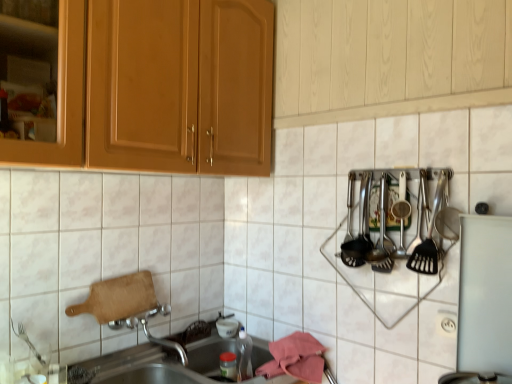
Question: Is polished stainless steel utensils at right, marked as the second silverware in a back-to-front arrangement, to the right of polished stainless steel utensils at right, which appears as the 1th silverware when viewed from the back, from the viewer's perspective?

Choices:
 (A) yes
 (B) no

Answer: (A)

Question: Does polished stainless steel utensils at right, marked as the second silverware in a back-to-front arrangement, have a larger size compared to polished stainless steel utensils at right, acting as the 1th silverware starting from the left?

Choices:
 (A) yes
 (B) no

Answer: (A)

Question: Could you tell me if polished stainless steel utensils at right, marked as the second silverware in a back-to-front arrangement, is facing polished stainless steel utensils at right, acting as the 1th silverware starting from the left?

Choices:
 (A) no
 (B) yes

Answer: (A)

Question: From the image's perspective, is polished stainless steel utensils at right, marked as the second silverware in a back-to-front arrangement, on top of polished stainless steel utensils at right, which appears as the 1th silverware when viewed from the back?

Choices:
 (A) yes
 (B) no

Answer: (B)

Question: From the image's perspective, is polished stainless steel utensils at right, arranged as the first silverware when viewed from the right, beneath polished stainless steel utensils at right, which is counted as the 2th silverware, starting from the front?

Choices:
 (A) yes
 (B) no

Answer: (A)

Question: Is polished stainless steel utensils at right, the 1th silverware from the front, turned away from polished stainless steel utensils at right, which appears as the second silverware when viewed from the right?

Choices:
 (A) yes
 (B) no

Answer: (B)

Question: Is white glossy tile at upper center aimed at white plastic electric outlet at lower right?

Choices:
 (A) no
 (B) yes

Answer: (B)

Question: From the image's perspective, is white glossy tile at upper center located beneath white plastic electric outlet at lower right?

Choices:
 (A) no
 (B) yes

Answer: (A)

Question: From the image's perspective, does white glossy tile at upper center appear higher than white plastic electric outlet at lower right?

Choices:
 (A) yes
 (B) no

Answer: (A)

Question: Is white glossy tile at upper center wider than white plastic electric outlet at lower right?

Choices:
 (A) yes
 (B) no

Answer: (A)

Question: Does white glossy tile at upper center appear on the right side of white plastic electric outlet at lower right?

Choices:
 (A) no
 (B) yes

Answer: (A)

Question: Is white glossy tile at upper center smaller than white plastic electric outlet at lower right?

Choices:
 (A) yes
 (B) no

Answer: (B)

Question: Considering the relative sizes of white plastic electric outlet at lower right and polished stainless steel utensils at right, acting as the 1th silverware starting from the left, in the image provided, is white plastic electric outlet at lower right shorter than polished stainless steel utensils at right, acting as the 1th silverware starting from the left,?

Choices:
 (A) no
 (B) yes

Answer: (B)